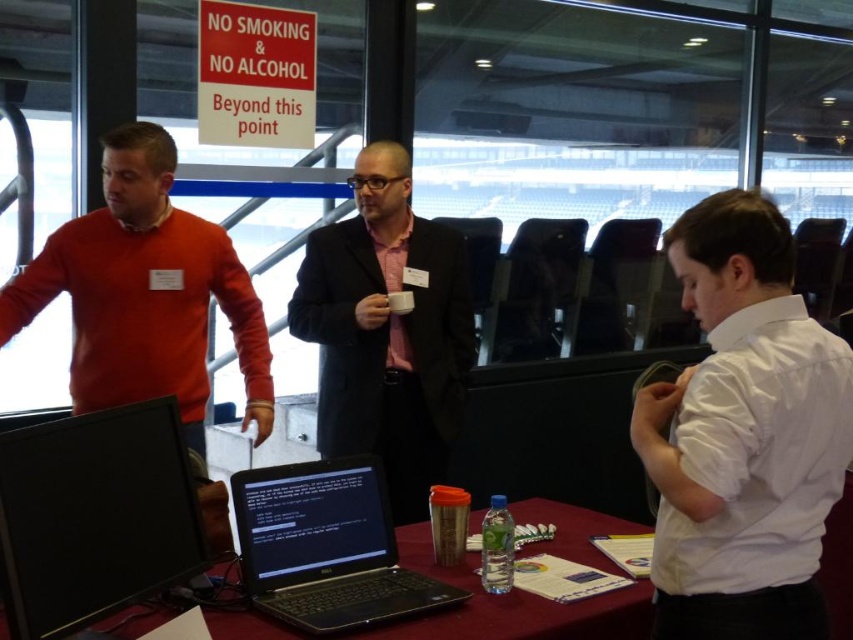
You are organizing a presentation and need to place a 12 inch wide projector between the white smooth shirt at right and the metallic silver laptop at center. Can you fit it there?

The white smooth shirt at right has a lesser width compared to metallic silver laptop at center. Since the projector is 12 inches wide, you need to check the available space between them. However, without knowing the exact distance between the two objects, it is impossible to determine if the projector will fit.